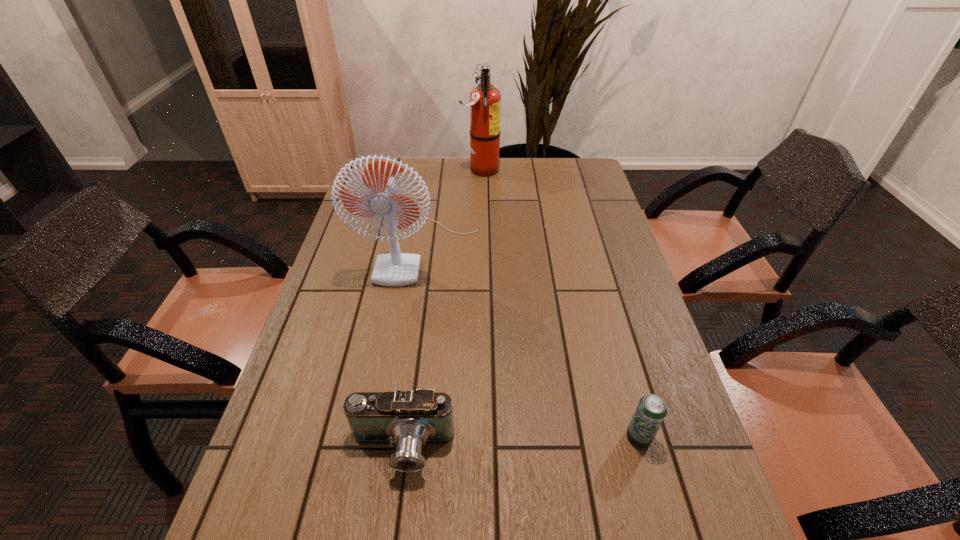
Where is `object located in the left edge section of the desktop`? Image resolution: width=960 pixels, height=540 pixels. object located in the left edge section of the desktop is located at coordinates (394, 269).

Find the location of a particular element. This screenshot has width=960, height=540. object situated at the right edge is located at coordinates (651, 410).

Image resolution: width=960 pixels, height=540 pixels. I want to click on vacant space at the far edge, so click(x=468, y=163).

Image resolution: width=960 pixels, height=540 pixels. Identify the location of free space at the left edge of the desktop. (368, 265).

Where is `free space at the right edge`? free space at the right edge is located at coordinates (561, 191).

Find the location of a particular element. The image size is (960, 540). vacant region at the far right corner of the desktop is located at coordinates (584, 164).

Where is `free space between the third nearest object and the fire extinguisher`? The image size is (960, 540). free space between the third nearest object and the fire extinguisher is located at coordinates click(450, 210).

Locate an element on the screen. vacant area between the camcorder and the fan is located at coordinates pos(412,349).

Find the location of a particular element. The width and height of the screenshot is (960, 540). free area in between the farthest object and the fan is located at coordinates (450, 210).

This screenshot has width=960, height=540. Find the location of `unoccupied position between the fire extinguisher and the fan`. unoccupied position between the fire extinguisher and the fan is located at coordinates (450, 210).